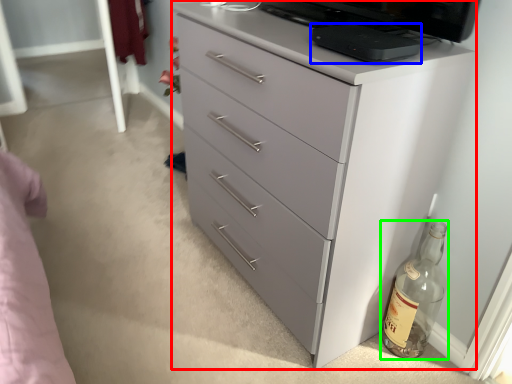
Question: Which object is the closest to the chest of drawers (highlighted by a red box)? Choose among these: appliance (highlighted by a blue box) or bottle (highlighted by a green box).

Choices:
 (A) appliance
 (B) bottle

Answer: (A)